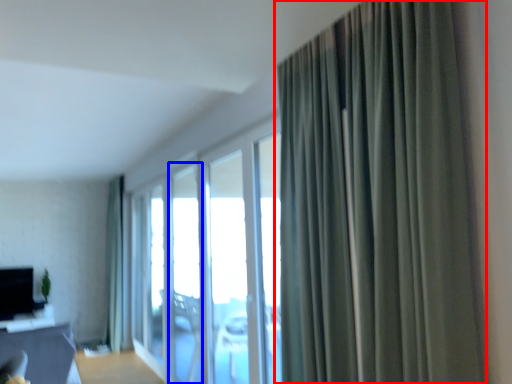
Question: Which point is further to the camera, curtain (highlighted by a red box) or window (highlighted by a blue box)?

Choices:
 (A) curtain
 (B) window

Answer: (B)